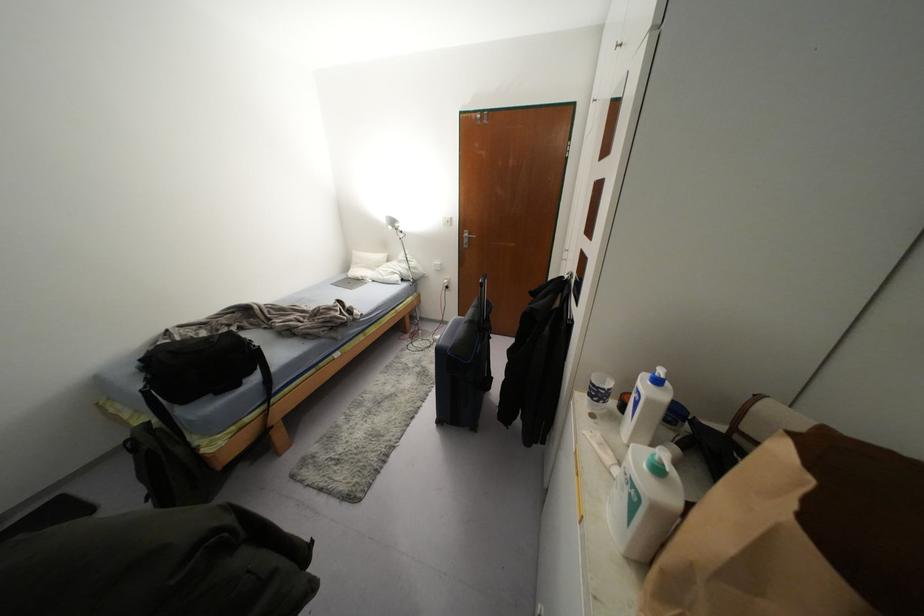
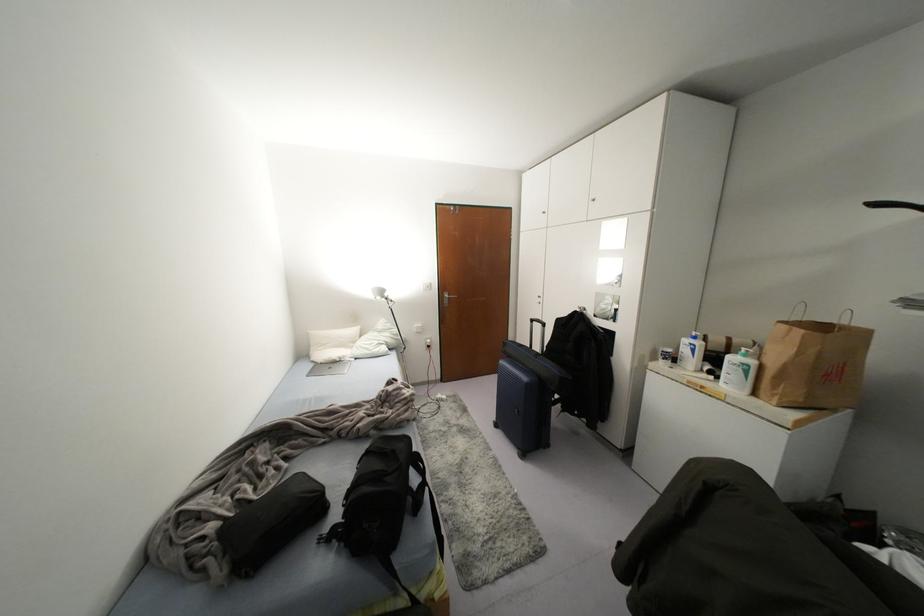
Question: I am providing you with two images of the same scene from different viewpoints. Which of the following objects are not visible in image2?

Choices:
 (A) suitcase handle
 (B) white bottle pump
 (C) silver laptop
 (D) none of these

Answer: (D)